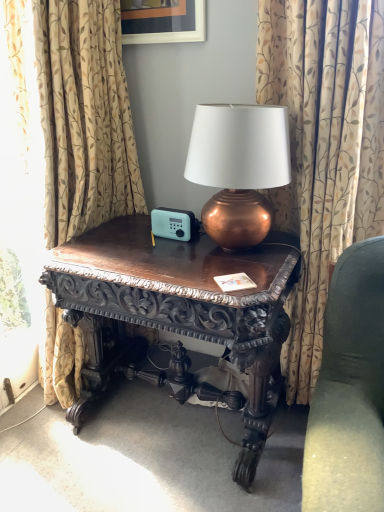
Question: Would you say matte black picture frame at upper center is to the left or to the right of dark wood carved table at center in the picture?

Choices:
 (A) right
 (B) left

Answer: (B)

Question: Considering the positions of matte black picture frame at upper center and dark wood carved table at center in the image, is matte black picture frame at upper center taller or shorter than dark wood carved table at center?

Choices:
 (A) tall
 (B) short

Answer: (B)

Question: Which is nearer to the beige floral fabric curtain at left, acting as the second curtain starting from the right?

Choices:
 (A) patterned fabric curtain at center, the 1th curtain in the right-to-left sequence
 (B) velvet green couch at right
 (C) copper metallic lamp at center
 (D) dark wood carved table at center
 (E) matte black picture frame at upper center

Answer: (D)

Question: Which object is positioned closest to the dark wood carved table at center?

Choices:
 (A) copper metallic lamp at center
 (B) velvet green couch at right
 (C) beige floral fabric curtain at left, which appears as the 1th curtain when viewed from the left
 (D) matte black picture frame at upper center
 (E) patterned fabric curtain at center, the second curtain when ordered from left to right

Answer: (A)